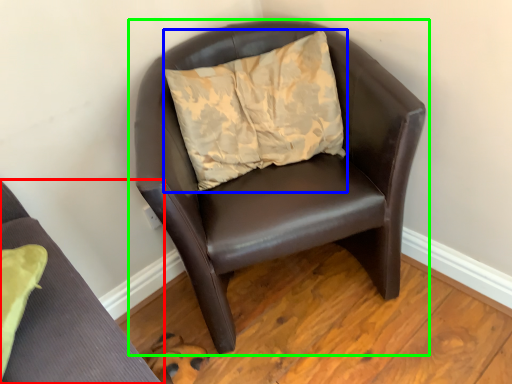
Question: Which object is the closest to the chair (highlighted by a red box)? Choose among these: pillow (highlighted by a blue box) or chair (highlighted by a green box).

Choices:
 (A) pillow
 (B) chair

Answer: (B)